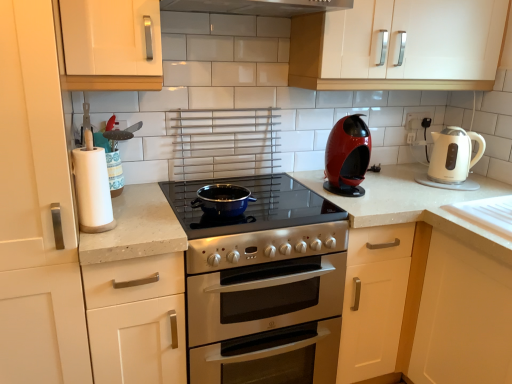
In order to click on empty space that is to the right of red glossy coffee machine at center right, the first kitchen appliance in the left-to-right sequence in this screenshot , I will do `click(386, 191)`.